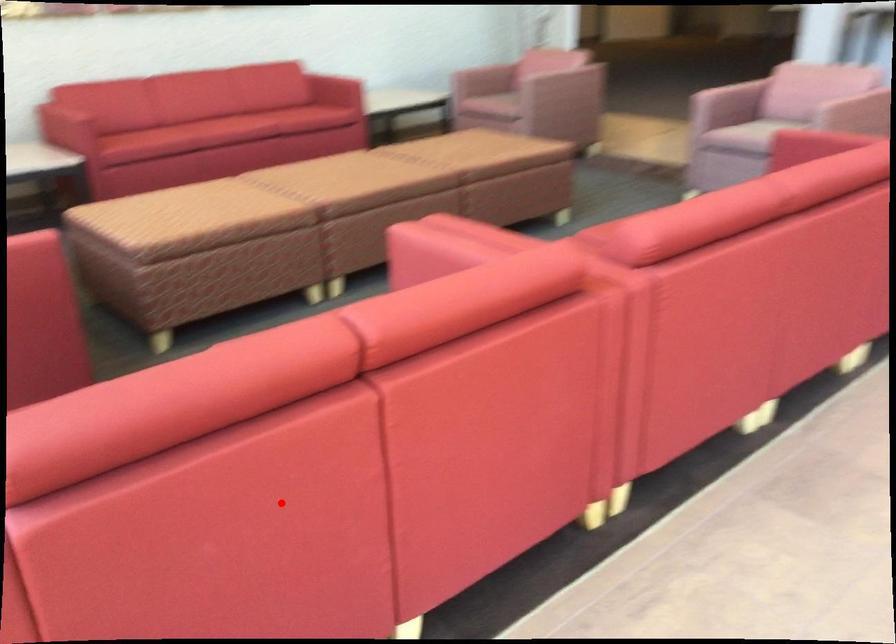
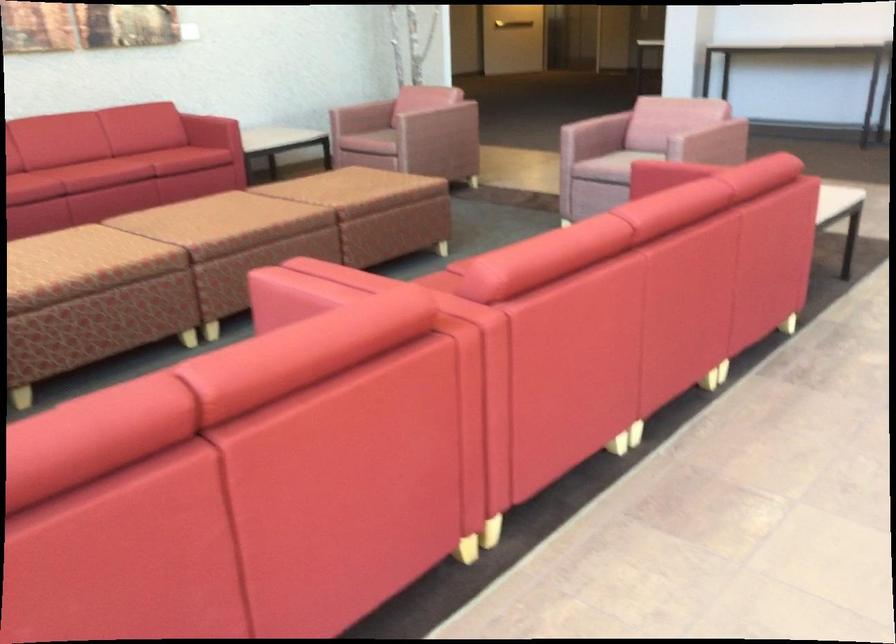
Locate, in the second image, the point that corresponds to the highlighted location in the first image.

(112, 574)